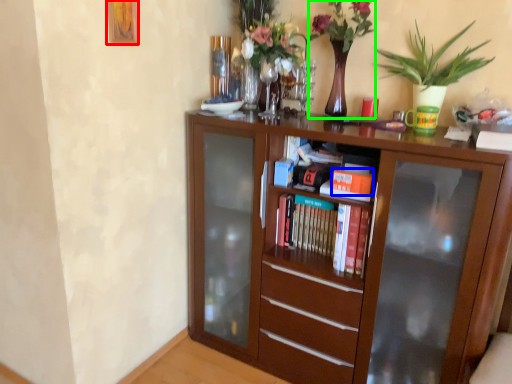
Question: Considering the real-world distances, which object is farthest from picture frame (highlighted by a red box)? book (highlighted by a blue box) or floral arrangement (highlighted by a green box)?

Choices:
 (A) book
 (B) floral arrangement

Answer: (A)